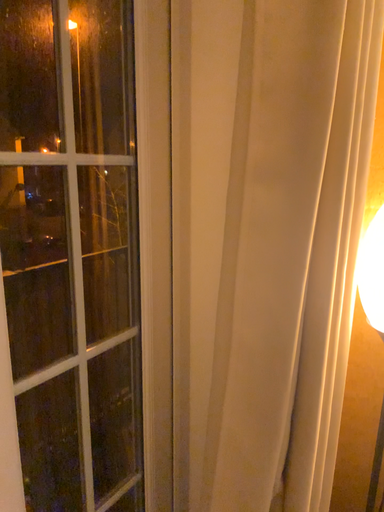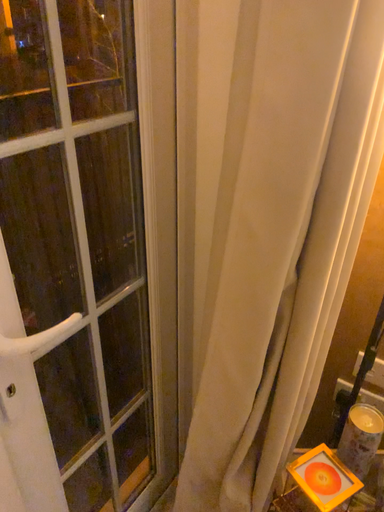
Question: How did the camera likely rotate when shooting the video?

Choices:
 (A) rotated upward
 (B) rotated downward

Answer: (B)